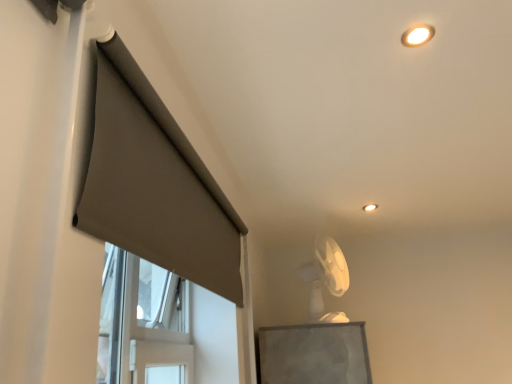
Question: Should I look upward or downward to see white plastic fan at upper center?

Choices:
 (A) up
 (B) down

Answer: (B)

Question: Can you confirm if white plastic fan at upper center is bigger than matte white ceiling light at upper center?

Choices:
 (A) no
 (B) yes

Answer: (B)

Question: From the image's perspective, would you say white plastic fan at upper center is shown under matte white ceiling light at upper center?

Choices:
 (A) yes
 (B) no

Answer: (A)

Question: Would you say white plastic fan at upper center is outside matte white ceiling light at upper center?

Choices:
 (A) yes
 (B) no

Answer: (A)

Question: Is white plastic fan at upper center positioned with its back to matte white ceiling light at upper center?

Choices:
 (A) yes
 (B) no

Answer: (B)

Question: Is white plastic fan at upper center positioned before matte white ceiling light at upper center?

Choices:
 (A) no
 (B) yes

Answer: (B)

Question: Does white plastic fan at upper center have a lesser height compared to matte white ceiling light at upper center?

Choices:
 (A) yes
 (B) no

Answer: (B)

Question: From the image's perspective, is matte white ceiling light at upper center above white plastic fan at upper center?

Choices:
 (A) no
 (B) yes

Answer: (B)

Question: Does matte white ceiling light at upper center have a greater height compared to white plastic fan at upper center?

Choices:
 (A) no
 (B) yes

Answer: (A)

Question: Could white plastic fan at upper center be considered to be inside matte white ceiling light at upper center?

Choices:
 (A) yes
 (B) no

Answer: (B)

Question: Does matte white ceiling light at upper center appear on the left side of white plastic fan at upper center?

Choices:
 (A) no
 (B) yes

Answer: (A)

Question: From a real-world perspective, is matte white ceiling light at upper center on top of white plastic fan at upper center?

Choices:
 (A) no
 (B) yes

Answer: (B)

Question: Is matte white ceiling light at upper center at the right side of white plastic fan at upper center?

Choices:
 (A) yes
 (B) no

Answer: (A)

Question: Is matte gray curtain at left facing towards white plastic fan at upper center?

Choices:
 (A) yes
 (B) no

Answer: (B)